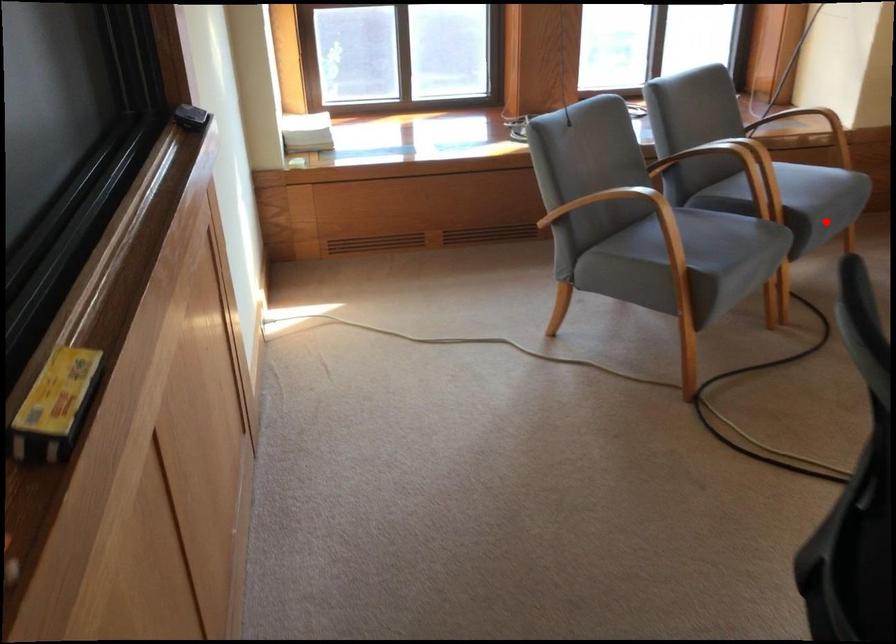
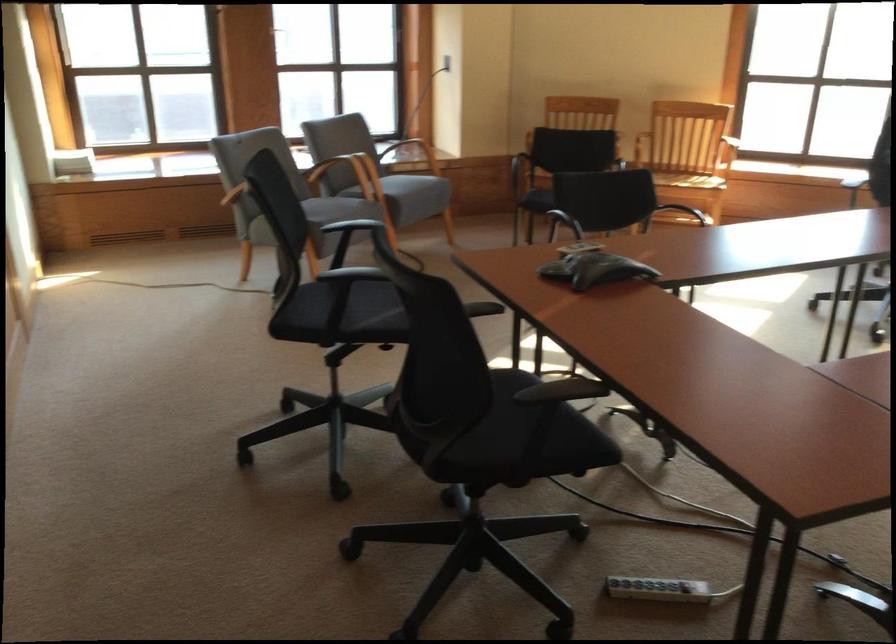
In the second image, find the point that corresponds to the highlighted location in the first image.

(410, 194)